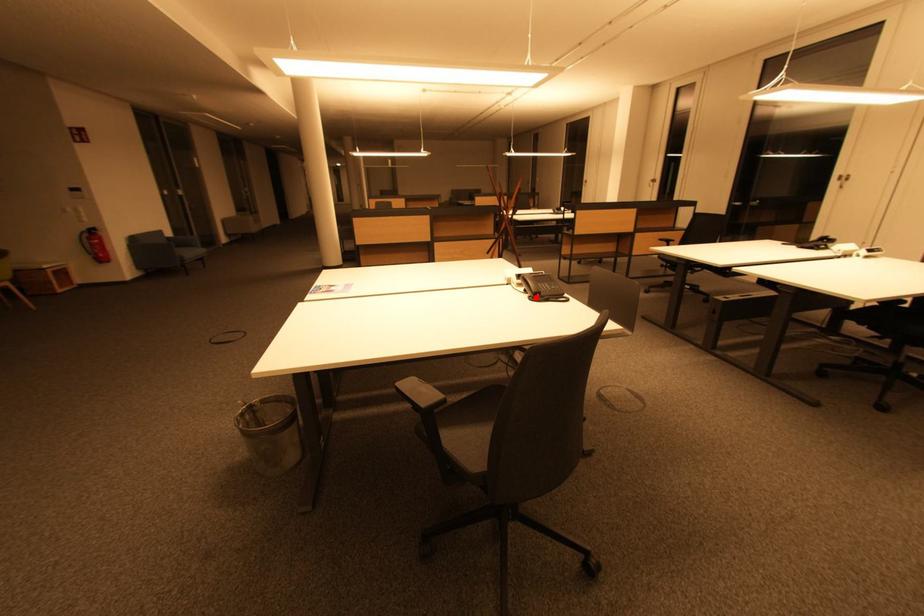
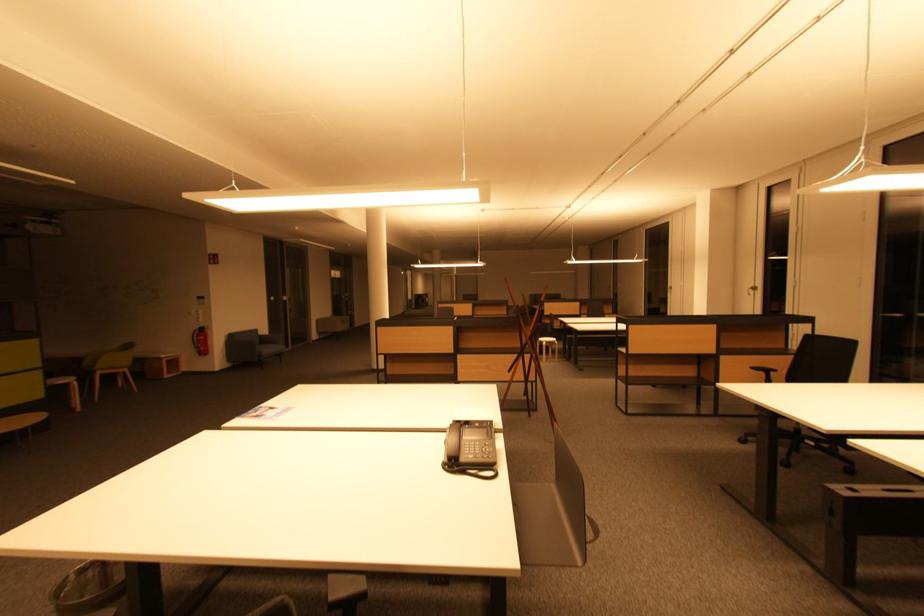
Where in the second image is the point corresponding to the highlighted location from the first image?

(450, 463)